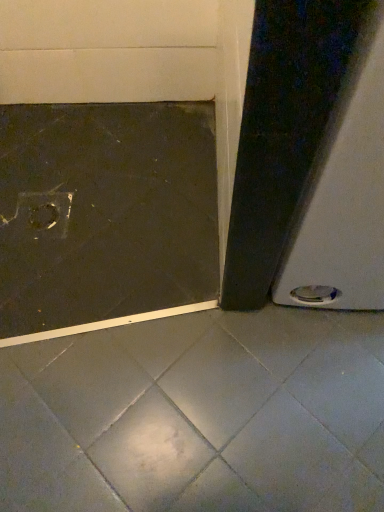
What is the approximate width of white glossy screen door at right?

It is 24.70 inches.

Where is `white glossy screen door at right`? Image resolution: width=384 pixels, height=512 pixels. white glossy screen door at right is located at coordinates (310, 160).

The width and height of the screenshot is (384, 512). What do you see at coordinates (310, 160) in the screenshot?
I see `white glossy screen door at right` at bounding box center [310, 160].

What is the approximate width of dark matte concrete at lower left?

The width of dark matte concrete at lower left is 3.69 feet.

The image size is (384, 512). What do you see at coordinates (198, 416) in the screenshot?
I see `dark matte concrete at lower left` at bounding box center [198, 416].

Where is `dark matte concrete at lower left`? The image size is (384, 512). dark matte concrete at lower left is located at coordinates (198, 416).

Locate an element on the screen. The width and height of the screenshot is (384, 512). white glossy screen door at right is located at coordinates (310, 160).

Which is more to the left, white glossy screen door at right or dark matte concrete at lower left?

Positioned to the left is dark matte concrete at lower left.

In the scene shown: Relative to dark matte concrete at lower left, is white glossy screen door at right in front or behind?

Visually, white glossy screen door at right is located in front of dark matte concrete at lower left.

Considering the points (298, 303) and (117, 362), which point is behind, point (298, 303) or point (117, 362)?

The point (298, 303) is behind.

From the image's perspective, which one is positioned higher, white glossy screen door at right or dark matte concrete at lower left?

From the image's view, white glossy screen door at right is above.

From a real-world perspective, is white glossy screen door at right above or below dark matte concrete at lower left?

white glossy screen door at right is situated higher than dark matte concrete at lower left in the real world.

Considering the relative sizes of white glossy screen door at right and dark matte concrete at lower left in the image provided, is white glossy screen door at right thinner than dark matte concrete at lower left?

Yes, white glossy screen door at right is thinner than dark matte concrete at lower left.

Who is taller, white glossy screen door at right or dark matte concrete at lower left?

With more height is white glossy screen door at right.

Between white glossy screen door at right and dark matte concrete at lower left, which one has smaller size?

With smaller size is dark matte concrete at lower left.

Is dark matte concrete at lower left a part of white glossy screen door at right?

That's incorrect, dark matte concrete at lower left is not inside white glossy screen door at right.

Are white glossy screen door at right and dark matte concrete at lower left far apart?

white glossy screen door at right is actually quite close to dark matte concrete at lower left.

Is white glossy screen door at right aimed at dark matte concrete at lower left?

No, white glossy screen door at right is not facing towards dark matte concrete at lower left.

Can you tell me how much white glossy screen door at right and dark matte concrete at lower left differ in facing direction?

91 degrees.

The image size is (384, 512). Identify the location of concrete below the white glossy screen door at right (from the image's perspective). (198, 416).

Between dark matte concrete at lower left and white glossy screen door at right, which one appears on the right side from the viewer's perspective?

white glossy screen door at right.

Is dark matte concrete at lower left positioned behind white glossy screen door at right?

Yes, it is behind white glossy screen door at right.

Does point (263, 376) come behind point (293, 111)?

Yes, it is.

From the image's perspective, which is above, dark matte concrete at lower left or white glossy screen door at right?

white glossy screen door at right.

From a real-world perspective, who is located lower, dark matte concrete at lower left or white glossy screen door at right?

From a 3D spatial view, dark matte concrete at lower left is below.

Based on the photo, is dark matte concrete at lower left thinner than white glossy screen door at right?

In fact, dark matte concrete at lower left might be wider than white glossy screen door at right.

Can you confirm if dark matte concrete at lower left is shorter than white glossy screen door at right?

Yes, dark matte concrete at lower left is shorter than white glossy screen door at right.

Considering the sizes of objects dark matte concrete at lower left and white glossy screen door at right in the image provided, who is bigger, dark matte concrete at lower left or white glossy screen door at right?

Bigger between the two is white glossy screen door at right.

Is dark matte concrete at lower left inside the boundaries of white glossy screen door at right, or outside?

dark matte concrete at lower left is not enclosed by white glossy screen door at right.

Is dark matte concrete at lower left not near white glossy screen door at right?

No, there isn't a large distance between dark matte concrete at lower left and white glossy screen door at right.

Could you tell me if dark matte concrete at lower left is turned towards white glossy screen door at right?

No, dark matte concrete at lower left is not aimed at white glossy screen door at right.

How different are the orientations of dark matte concrete at lower left and white glossy screen door at right in degrees?

There is a 91-degree angle between the facing directions of dark matte concrete at lower left and white glossy screen door at right.

Find the location of a particular element. Image resolution: width=384 pixels, height=512 pixels. screen door in front of the dark matte concrete at lower left is located at coordinates (310, 160).

The width and height of the screenshot is (384, 512). I want to click on screen door above the dark matte concrete at lower left (from a real-world perspective), so click(x=310, y=160).

Image resolution: width=384 pixels, height=512 pixels. Identify the location of concrete located on the left of white glossy screen door at right. (198, 416).